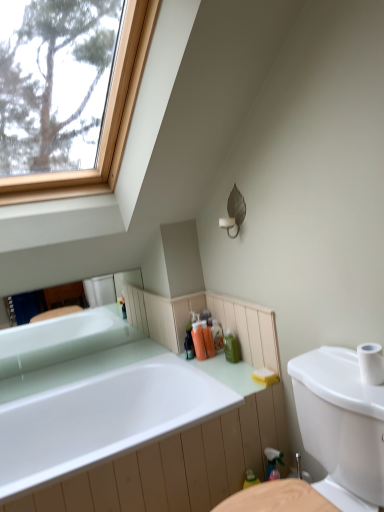
At what (x,y) coordinates should I click in order to perform the action: click on translucent plastic bottles at center, the 1th toiletry positioned from the left. Please return your answer as a coordinate pair (x, y). The height and width of the screenshot is (512, 384). Looking at the image, I should click on (198, 341).

What do you see at coordinates (231, 347) in the screenshot?
I see `green matte bottle at center, the fourth toiletry from the left` at bounding box center [231, 347].

What do you see at coordinates (62, 339) in the screenshot?
I see `white glossy bathtub at upper left, which appears as the second bathtub when ordered from the bottom` at bounding box center [62, 339].

The width and height of the screenshot is (384, 512). Identify the location of translucent plastic bottles at center, which is counted as the 2th toiletry, starting from the right. 217,336.

Measure the distance between translucent plastic bottles at center, which is counted as the 2th toiletry, starting from the right, and camera.

translucent plastic bottles at center, which is counted as the 2th toiletry, starting from the right, is 6.92 feet away from camera.

The height and width of the screenshot is (512, 384). Describe the element at coordinates (265, 376) in the screenshot. I see `yellow sponge at lower right` at that location.

The height and width of the screenshot is (512, 384). What are the coordinates of `yellow sponge at lower right` in the screenshot? It's located at (265, 376).

Describe the element at coordinates (102, 418) in the screenshot. This screenshot has height=512, width=384. I see `white glossy bathtub at center, which is counted as the 1th bathtub, starting from the bottom` at that location.

At what (x,y) coordinates should I click in order to perform the action: click on translucent plastic bottles at center, the 1th toiletry positioned from the left. Please return your answer as a coordinate pair (x, y). This screenshot has width=384, height=512. Looking at the image, I should click on (198, 341).

Considering the sizes of objects green matte bottle at center, the fourth toiletry from the left, and white glossy sink at center in the image provided, who is shorter, green matte bottle at center, the fourth toiletry from the left, or white glossy sink at center?

With less height is green matte bottle at center, the fourth toiletry from the left.

Considering the sizes of green matte bottle at center, placed as the 1th toiletry when sorted from right to left, and white glossy sink at center in the image, is green matte bottle at center, placed as the 1th toiletry when sorted from right to left, bigger or smaller than white glossy sink at center?

In the image, green matte bottle at center, placed as the 1th toiletry when sorted from right to left, appears to be smaller than white glossy sink at center.

Is green matte bottle at center, the fourth toiletry from the left, behind white glossy sink at center?

Yes, green matte bottle at center, the fourth toiletry from the left, is behind white glossy sink at center.

Considering the points (252, 375) and (212, 337), which point is behind, point (252, 375) or point (212, 337)?

Positioned behind is point (212, 337).

Between yellow sponge at lower right and translucent orange soap at center, arranged as the second toiletry when viewed from the left, which one has less height?

Standing shorter between the two is yellow sponge at lower right.

From the image's perspective, between yellow sponge at lower right and translucent orange soap at center, arranged as the second toiletry when viewed from the left, which one is located above?

From the image's view, translucent orange soap at center, arranged as the second toiletry when viewed from the left, is above.

Is yellow sponge at lower right facing towards translucent orange soap at center, arranged as the second toiletry when viewed from the left?

No.

Which toiletry is the 2nd one when counting from the back of the translucent plastic bottles at center, the 1th toiletry positioned from the left? Please provide its 2D coordinates.

[(217, 336)]

From the image's perspective, which object appears higher, translucent plastic bottles at center, the 1th toiletry positioned from the left, or translucent plastic bottles at center, which appears as the 3th toiletry when viewed from the left?

translucent plastic bottles at center, which appears as the 3th toiletry when viewed from the left, is shown above in the image.

Could you tell me if translucent plastic bottles at center, the 1th toiletry positioned from the left, is facing translucent plastic bottles at center, which is counted as the 2th toiletry, starting from the right?

No, translucent plastic bottles at center, the 1th toiletry positioned from the left, is not aimed at translucent plastic bottles at center, which is counted as the 2th toiletry, starting from the right.

Is translucent plastic bottles at center, the 1th toiletry positioned from the left, at the right side of translucent plastic bottles at center, which is counted as the 2th toiletry, starting from the right?

Incorrect, translucent plastic bottles at center, the 1th toiletry positioned from the left, is not on the right side of translucent plastic bottles at center, which is counted as the 2th toiletry, starting from the right.

Is white glossy bathtub at upper left, placed as the first bathtub when sorted from top to bottom, looking in the opposite direction of yellow sponge at lower right?

white glossy bathtub at upper left, placed as the first bathtub when sorted from top to bottom, does not have its back to yellow sponge at lower right.

Which of these two, white glossy bathtub at upper left, which appears as the second bathtub when ordered from the bottom, or yellow sponge at lower right, is wider?

With larger width is yellow sponge at lower right.

Is white glossy bathtub at upper left, placed as the first bathtub when sorted from top to bottom, not close to yellow sponge at lower right?

Yes, white glossy bathtub at upper left, placed as the first bathtub when sorted from top to bottom, and yellow sponge at lower right are located far from each other.

How different are the orientations of white glossy bathtub at upper left, which appears as the second bathtub when ordered from the bottom, and yellow sponge at lower right in degrees?

The facing directions of white glossy bathtub at upper left, which appears as the second bathtub when ordered from the bottom, and yellow sponge at lower right are 90.6 degrees apart.

Choose the correct answer: Is white glossy bathtub at upper left, placed as the first bathtub when sorted from top to bottom, inside white matte toilet paper at right or outside it?

white glossy bathtub at upper left, placed as the first bathtub when sorted from top to bottom, exists outside the volume of white matte toilet paper at right.

Can you confirm if white glossy bathtub at upper left, which appears as the second bathtub when ordered from the bottom, is bigger than white matte toilet paper at right?

Yes, white glossy bathtub at upper left, which appears as the second bathtub when ordered from the bottom, is bigger than white matte toilet paper at right.

Which is behind, white glossy bathtub at upper left, which appears as the second bathtub when ordered from the bottom, or white matte toilet paper at right?

white glossy bathtub at upper left, which appears as the second bathtub when ordered from the bottom, is more distant.

Does white glossy bathtub at upper left, which appears as the second bathtub when ordered from the bottom, have a greater width compared to white glossy sink at center?

No, white glossy bathtub at upper left, which appears as the second bathtub when ordered from the bottom, is not wider than white glossy sink at center.

How much distance is there between white glossy bathtub at upper left, which appears as the second bathtub when ordered from the bottom, and white glossy sink at center?

The distance of white glossy bathtub at upper left, which appears as the second bathtub when ordered from the bottom, from white glossy sink at center is 5.36 feet.

Is white glossy bathtub at upper left, which appears as the second bathtub when ordered from the bottom, further to the viewer compared to white glossy sink at center?

Yes, it is behind white glossy sink at center.

From a real-world perspective, is white glossy bathtub at upper left, which appears as the second bathtub when ordered from the bottom, physically located above or below white glossy sink at center?

In terms of real-world spatial position, white glossy bathtub at upper left, which appears as the second bathtub when ordered from the bottom, is above white glossy sink at center.

Could you tell me if translucent plastic bottles at center, the 1th toiletry positioned from the left, is facing white glossy bathtub at center, which appears as the 2th bathtub when viewed from the top?

No.

Consider the image. Is translucent plastic bottles at center, the 4th toiletry positioned from the right, to the left of white glossy bathtub at center, which is counted as the 1th bathtub, starting from the bottom, from the viewer's perspective?

In fact, translucent plastic bottles at center, the 4th toiletry positioned from the right, is to the right of white glossy bathtub at center, which is counted as the 1th bathtub, starting from the bottom.

Looking at this image, considering the sizes of objects translucent plastic bottles at center, the 1th toiletry positioned from the left, and white glossy bathtub at center, which appears as the 2th bathtub when viewed from the top, in the image provided, who is bigger, translucent plastic bottles at center, the 1th toiletry positioned from the left, or white glossy bathtub at center, which appears as the 2th bathtub when viewed from the top,?

white glossy bathtub at center, which appears as the 2th bathtub when viewed from the top.

I want to click on the 1st toiletry to the right when counting from the white glossy bathtub at center, which is counted as the 1th bathtub, starting from the bottom, so click(x=198, y=341).

Identify the location of toiletry that is the 1st object to the left of the white glossy sink at center, starting at the anchor. The image size is (384, 512). (231, 347).

Find the location of `the 3rd toiletry behind the yellow sponge at lower right, counting from the anchor's position`. the 3rd toiletry behind the yellow sponge at lower right, counting from the anchor's position is located at coordinates (208, 340).

Consider the image. From the image, which object appears to be nearer to green matte bottle at center, placed as the 1th toiletry when sorted from right to left, yellow sponge at lower right or translucent plastic bottles at center, which appears as the 3th toiletry when viewed from the left?

translucent plastic bottles at center, which appears as the 3th toiletry when viewed from the left, is closer to green matte bottle at center, placed as the 1th toiletry when sorted from right to left.

Which object lies further to the anchor point white glossy bathtub at center, which appears as the 2th bathtub when viewed from the top, yellow sponge at lower right or white glossy bathtub at upper left, placed as the first bathtub when sorted from top to bottom?

white glossy bathtub at upper left, placed as the first bathtub when sorted from top to bottom.

Considering their positions, is translucent plastic bottles at center, which is counted as the 2th toiletry, starting from the right, positioned further to white glossy bathtub at upper left, which appears as the second bathtub when ordered from the bottom, than white glossy bathtub at center, which is counted as the 1th bathtub, starting from the bottom?

translucent plastic bottles at center, which is counted as the 2th toiletry, starting from the right.

When comparing their distances from translucent plastic bottles at center, the 1th toiletry positioned from the left, does white glossy sink at center or translucent orange soap at center, arranged as the second toiletry when viewed from the left, seem further?

white glossy sink at center is positioned further to the anchor translucent plastic bottles at center, the 1th toiletry positioned from the left.

Estimate the real-world distances between objects in this image. Which object is closer to white glossy bathtub at center, which is counted as the 1th bathtub, starting from the bottom, translucent plastic bottles at center, the 1th toiletry positioned from the left, or translucent plastic bottles at center, which is counted as the 2th toiletry, starting from the right?

The object closer to white glossy bathtub at center, which is counted as the 1th bathtub, starting from the bottom, is translucent plastic bottles at center, the 1th toiletry positioned from the left.

Looking at the image, which one is located closer to white glossy sink at center, white glossy bathtub at upper left, which appears as the second bathtub when ordered from the bottom, or white matte toilet paper at right?

Based on the image, white matte toilet paper at right appears to be nearer to white glossy sink at center.

Which object lies nearer to the anchor point white glossy bathtub at center, which is counted as the 1th bathtub, starting from the bottom, yellow sponge at lower right or white glossy sink at center?

yellow sponge at lower right is closer to white glossy bathtub at center, which is counted as the 1th bathtub, starting from the bottom.

Which object lies further to the anchor point white matte toilet paper at right, translucent plastic bottles at center, the 1th toiletry positioned from the left, or white glossy sink at center?

Based on the image, translucent plastic bottles at center, the 1th toiletry positioned from the left, appears to be further to white matte toilet paper at right.

Where is `toilet paper positioned between white glossy sink at center and white glossy bathtub at upper left, placed as the first bathtub when sorted from top to bottom, from near to far`? toilet paper positioned between white glossy sink at center and white glossy bathtub at upper left, placed as the first bathtub when sorted from top to bottom, from near to far is located at coordinates (371, 362).

Identify the location of toilet paper between white glossy sink at center and translucent orange soap at center, positioned as the 3th toiletry in right-to-left order, from front to back. Image resolution: width=384 pixels, height=512 pixels. (371, 362).

What are the coordinates of `bathtub between white glossy sink at center and translucent orange soap at center, positioned as the 3th toiletry in right-to-left order, along the z-axis` in the screenshot? It's located at (102, 418).

This screenshot has height=512, width=384. In order to click on soap located between white glossy bathtub at center, which appears as the 2th bathtub when viewed from the top, and translucent orange soap at center, positioned as the 3th toiletry in right-to-left order, in the depth direction in this screenshot , I will do `click(265, 376)`.